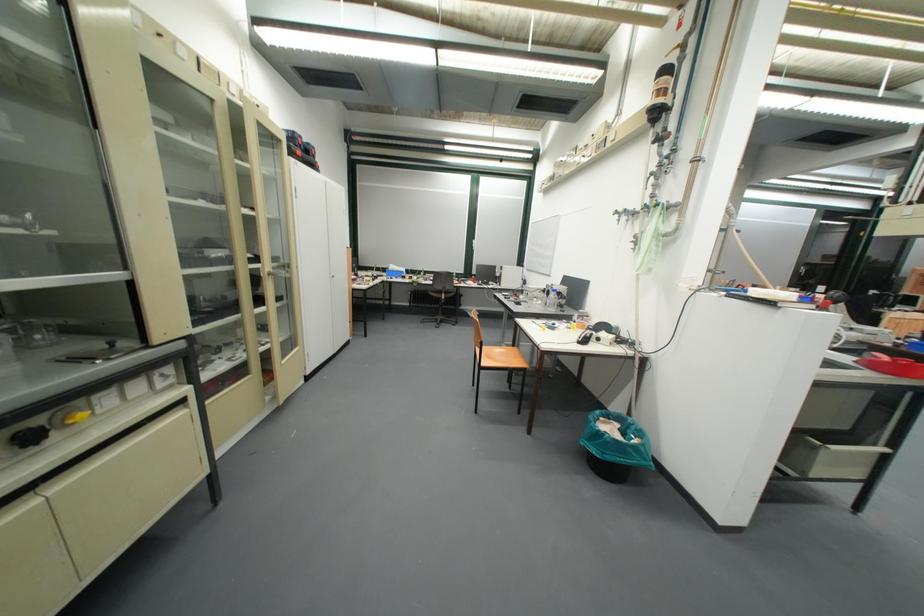
Where would you push the yellow lever switch? Please return your answer as a coordinate pair (x, y).

(76, 416)